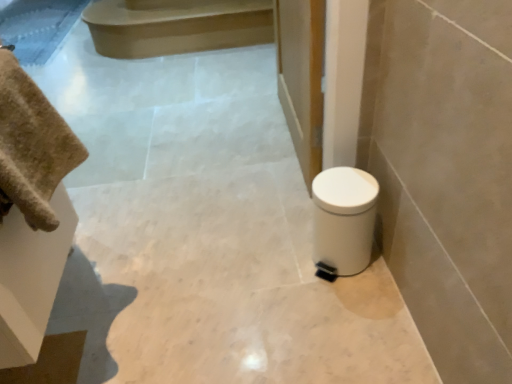
The image size is (512, 384). In order to click on white plastic toilet at lower right in this screenshot , I will do `click(344, 219)`.

At what (x,y) coordinates should I click in order to perform the action: click on smooth beige stair at upper center. Please return your answer as a coordinate pair (x, y). Looking at the image, I should click on (176, 26).

The image size is (512, 384). I want to click on white plastic toilet at lower right, so click(x=344, y=219).

Which is behind, point (332, 217) or point (270, 10)?

The point (270, 10) is farther from the camera.

Is white plastic toilet at lower right directly adjacent to smooth beige stair at upper center?

No, white plastic toilet at lower right is not with smooth beige stair at upper center.

Is white plastic toilet at lower right shorter than smooth beige stair at upper center?

No.

Which of these two, white plastic toilet at lower right or smooth beige stair at upper center, is bigger?

smooth beige stair at upper center.

From the picture: Could you tell me if smooth beige stair at upper center is turned towards beige cotton towel at left?

No, smooth beige stair at upper center is not oriented towards beige cotton towel at left.

Is beige cotton towel at left a part of smooth beige stair at upper center?

No, beige cotton towel at left is not surrounded by smooth beige stair at upper center.

Looking at this image, can you tell me how much smooth beige stair at upper center and beige cotton towel at left differ in facing direction?

smooth beige stair at upper center and beige cotton towel at left are facing 89.2 degrees away from each other.

Considering the sizes of smooth beige stair at upper center and beige cotton towel at left in the image, is smooth beige stair at upper center taller or shorter than beige cotton towel at left?

Considering their sizes, smooth beige stair at upper center has less height than beige cotton towel at left.

Considering the sizes of objects beige cotton towel at left and white plastic toilet at lower right in the image provided, who is thinner, beige cotton towel at left or white plastic toilet at lower right?

beige cotton towel at left.

Who is more distant, beige cotton towel at left or white plastic toilet at lower right?

white plastic toilet at lower right.

Which point is more distant from viewer, (8, 200) or (344, 248)?

Positioned behind is point (344, 248).

Is beige cotton towel at left looking in the opposite direction of white plastic toilet at lower right?

No, beige cotton towel at left is not facing away from white plastic toilet at lower right.

Consider the image. Is white plastic toilet at lower right facing towards beige cotton towel at left?

No, white plastic toilet at lower right is not oriented towards beige cotton towel at left.

From a real-world perspective, is white plastic toilet at lower right located beneath beige cotton towel at left?

Indeed, from a real-world perspective, white plastic toilet at lower right is positioned beneath beige cotton towel at left.

How far apart are white plastic toilet at lower right and beige cotton towel at left?

white plastic toilet at lower right is 25.75 inches away from beige cotton towel at left.

Considering the relative sizes of white plastic toilet at lower right and beige cotton towel at left in the image provided, is white plastic toilet at lower right shorter than beige cotton towel at left?

No, white plastic toilet at lower right is not shorter than beige cotton towel at left.

Find the location of `stair located behind the beige cotton towel at left`. stair located behind the beige cotton towel at left is located at coordinates (176, 26).

Which object is positioned more to the right, beige cotton towel at left or smooth beige stair at upper center?

From the viewer's perspective, beige cotton towel at left appears more on the right side.

Between beige cotton towel at left and smooth beige stair at upper center, which one has smaller size?

beige cotton towel at left.

From the image's perspective, is beige cotton towel at left above smooth beige stair at upper center?

No, from the image's perspective, beige cotton towel at left is not over smooth beige stair at upper center.

Which is behind, point (166, 17) or point (355, 192)?

Point (166, 17)

From the image's perspective, which object appears higher, smooth beige stair at upper center or white plastic toilet at lower right?

smooth beige stair at upper center appears higher in the image.

Can you confirm if smooth beige stair at upper center is shorter than white plastic toilet at lower right?

Yes.

Which object is further away from the camera taking this photo, smooth beige stair at upper center or white plastic toilet at lower right?

smooth beige stair at upper center.

You are a GUI agent. You are given a task and a screenshot of the screen. Output one action in this format:
    pyautogui.click(x=<x>, y=<y>)
    Task: Click on the toilet on the right of smooth beige stair at upper center
    
    Given the screenshot: What is the action you would take?
    pyautogui.click(x=344, y=219)

Where is `bath towel positioned vertically above the smooth beige stair at upper center (from a real-world perspective)`? The image size is (512, 384). bath towel positioned vertically above the smooth beige stair at upper center (from a real-world perspective) is located at coordinates (32, 146).

Looking at the image, which one is located closer to beige cotton towel at left, white plastic toilet at lower right or smooth beige stair at upper center?

white plastic toilet at lower right lies closer to beige cotton towel at left than the other object.

From the picture: Which object lies further to the anchor point smooth beige stair at upper center, beige cotton towel at left or white plastic toilet at lower right?

Based on the image, beige cotton towel at left appears to be further to smooth beige stair at upper center.

When comparing their distances from smooth beige stair at upper center, does white plastic toilet at lower right or beige cotton towel at left seem further?

beige cotton towel at left is positioned further to the anchor smooth beige stair at upper center.

Considering their positions, is beige cotton towel at left positioned closer to white plastic toilet at lower right than smooth beige stair at upper center?

beige cotton towel at left lies closer to white plastic toilet at lower right than the other object.

Estimate the real-world distances between objects in this image. Which object is further from white plastic toilet at lower right, smooth beige stair at upper center or beige cotton towel at left?

Among the two, smooth beige stair at upper center is located further to white plastic toilet at lower right.

Estimate the real-world distances between objects in this image. Which object is closer to beige cotton towel at left, smooth beige stair at upper center or white plastic toilet at lower right?

white plastic toilet at lower right is closer to beige cotton towel at left.

This screenshot has width=512, height=384. In order to click on toilet between beige cotton towel at left and smooth beige stair at upper center from front to back in this screenshot , I will do `click(344, 219)`.